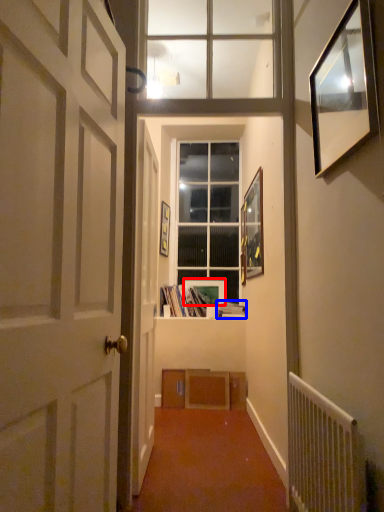
Question: Which of the following is the closest to the observer, picture frame (highlighted by a red box) or book (highlighted by a blue box)?

Choices:
 (A) picture frame
 (B) book

Answer: (B)